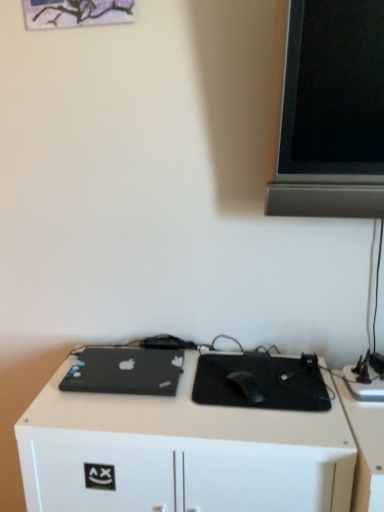
Locate an element on the screen. The height and width of the screenshot is (512, 384). free spot in front of black matte laptop at lower left is located at coordinates (120, 417).